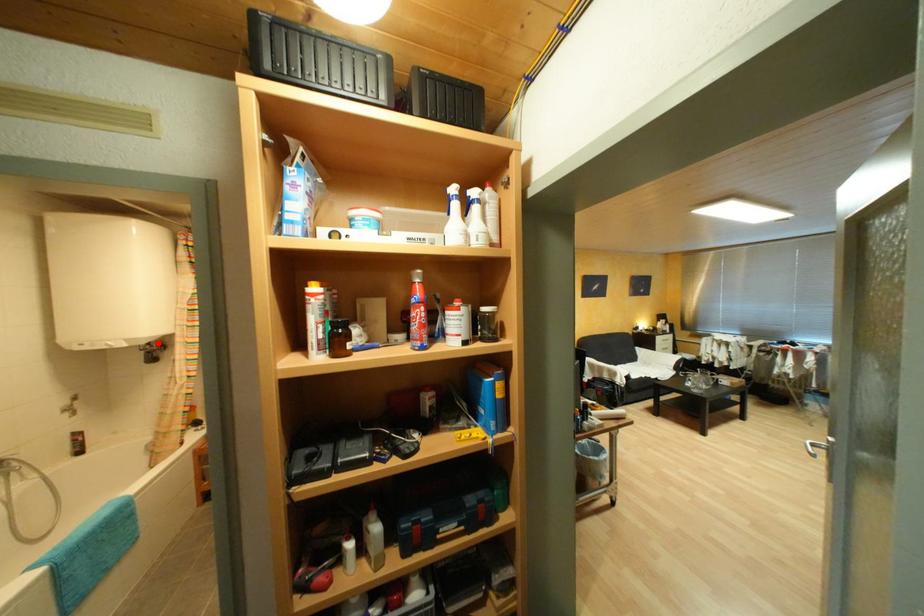
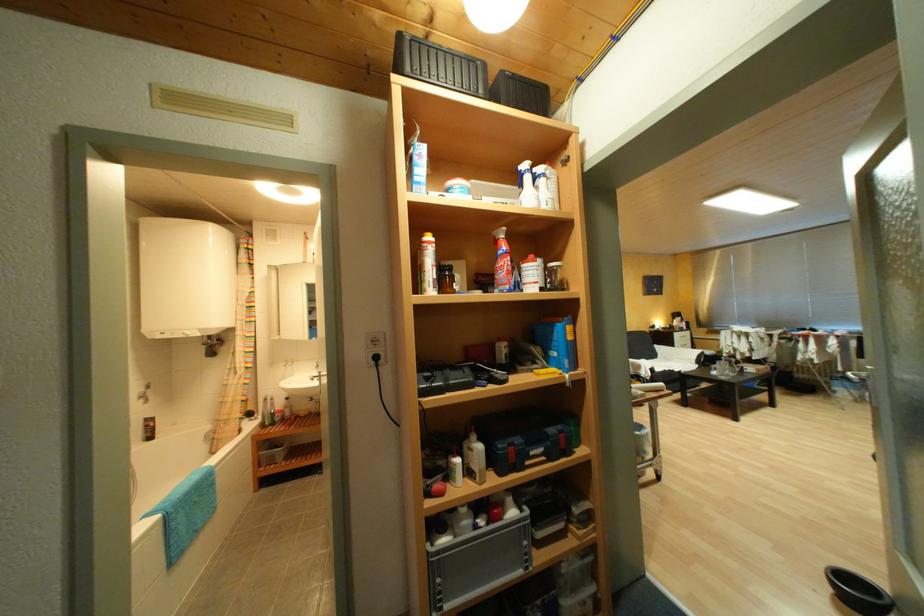
The point at the highlighted location is marked in the first image. Where is the corresponding point in the second image?

(220, 338)